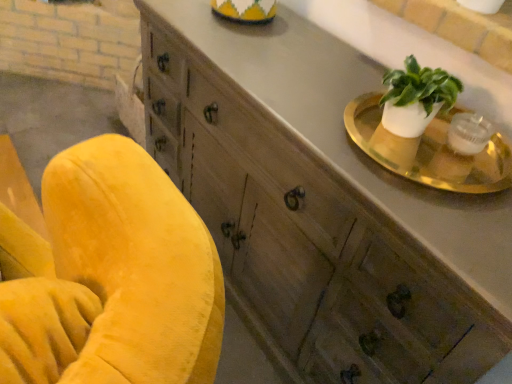
Question: From a real-world perspective, is gold metallic tray at upper right physically located above or below wooden cabinet at upper right?

Choices:
 (A) below
 (B) above

Answer: (B)

Question: Is gold metallic tray at upper right inside or outside of wooden cabinet at upper right?

Choices:
 (A) outside
 (B) inside

Answer: (B)

Question: Is gold metallic tray at upper right wider or thinner than wooden cabinet at upper right?

Choices:
 (A) thin
 (B) wide

Answer: (A)

Question: Is point (244, 221) closer or farther from the camera than point (483, 180)?

Choices:
 (A) farther
 (B) closer

Answer: (A)

Question: Considering the positions of wooden cabinet at upper right and gold metallic tray at upper right in the image, is wooden cabinet at upper right bigger or smaller than gold metallic tray at upper right?

Choices:
 (A) small
 (B) big

Answer: (B)

Question: In terms of width, does wooden cabinet at upper right look wider or thinner when compared to gold metallic tray at upper right?

Choices:
 (A) wide
 (B) thin

Answer: (A)

Question: From the image's perspective, is wooden cabinet at upper right located above or below gold metallic tray at upper right?

Choices:
 (A) above
 (B) below

Answer: (B)